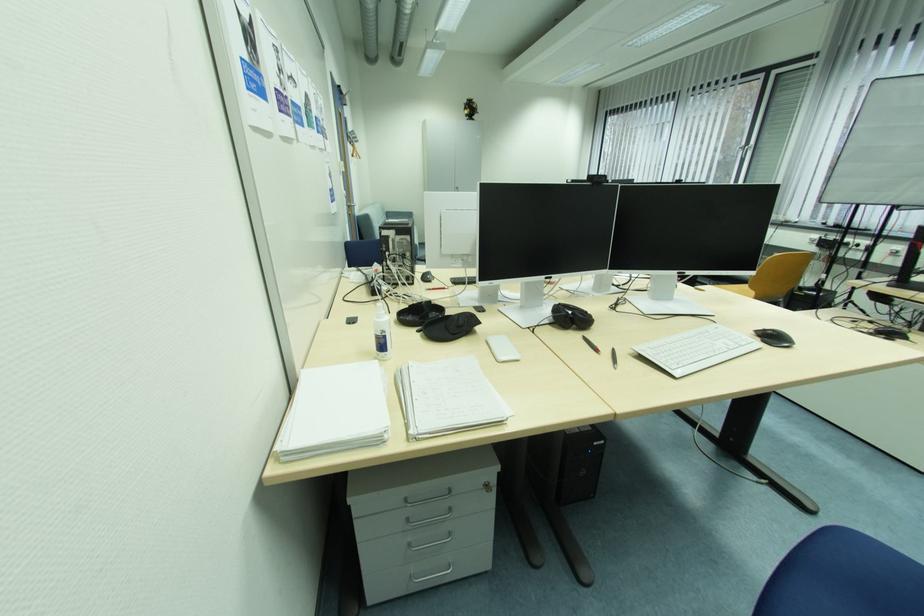
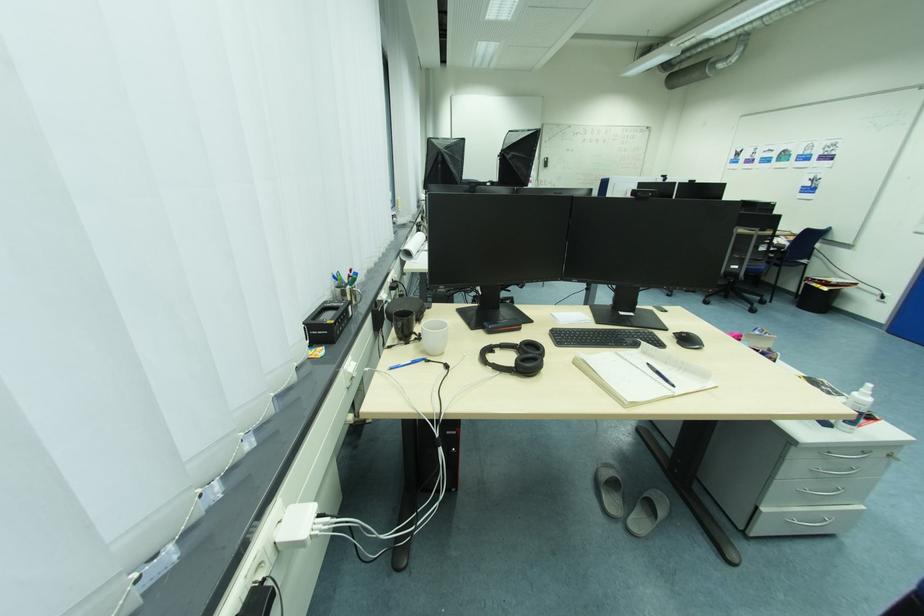
Question: I am providing you with two images of the same scene from different viewpoints. After the viewpoint changes to image2, which objects are now occluded?

Choices:
 (A) bench adjustment knob
 (B) grey slipper
 (C) black computer mouse
 (D) chair armrest

Answer: (C)